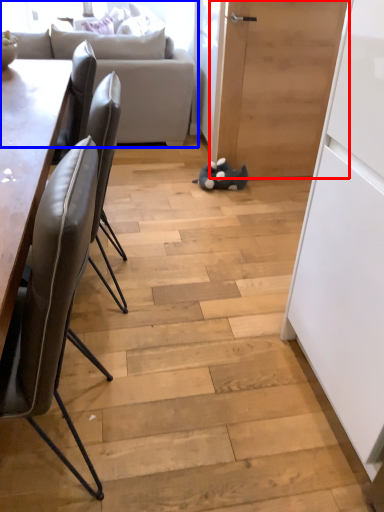
Question: Which object is closer to the camera taking this photo, door (highlighted by a red box) or studio couch (highlighted by a blue box)?

Choices:
 (A) door
 (B) studio couch

Answer: (A)